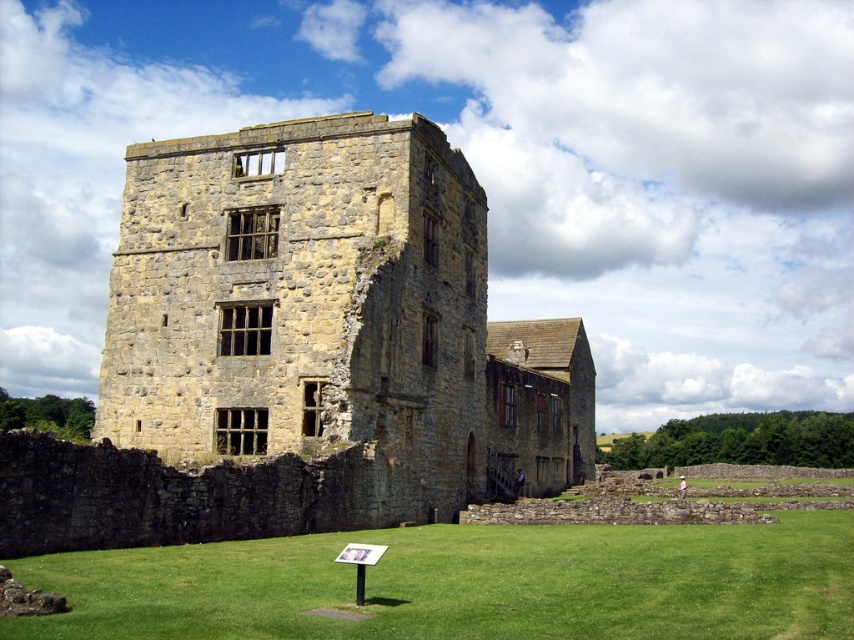
You are standing in front of the historic stone building and want to walk towards the yellow stone tower at center. Which direction should you move relative to the green grass at lower center?

You should move towards the yellow stone tower at center, which is closer to you than the green grass at lower center, so you can walk forward towards it without needing to adjust your position relative to the green grass at lower center.

You are standing at the entrance of the historic stone building and want to locate the yellow stone tower at center. According to the coordinates provided, where should you look relative to your position?

The yellow stone tower at center is located at coordinates point (301,349), which means it is positioned slightly to the right and above your current viewpoint. You should look towards the upper right direction from your current position to find it.